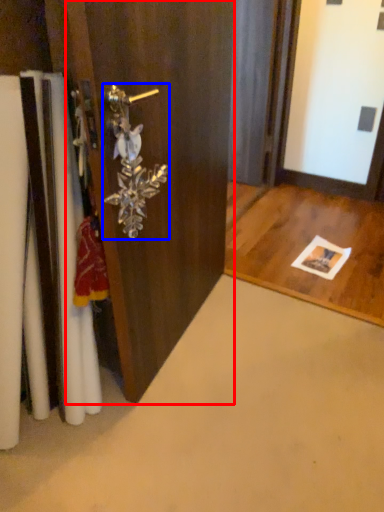
Question: Which object appears closest to the camera in this image, door (highlighted by a red box) or door handle (highlighted by a blue box)?

Choices:
 (A) door
 (B) door handle

Answer: (A)